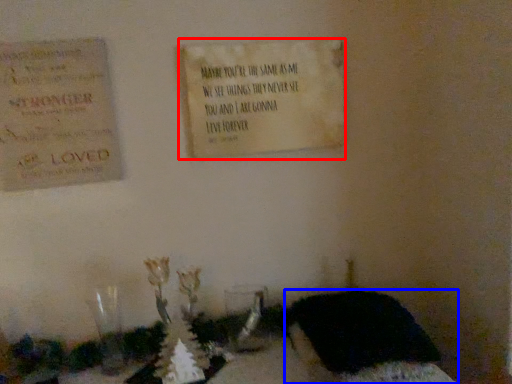
Question: Which point is closer to the camera, notice (highlighted by a red box) or furniture (highlighted by a blue box)?

Choices:
 (A) notice
 (B) furniture

Answer: (B)